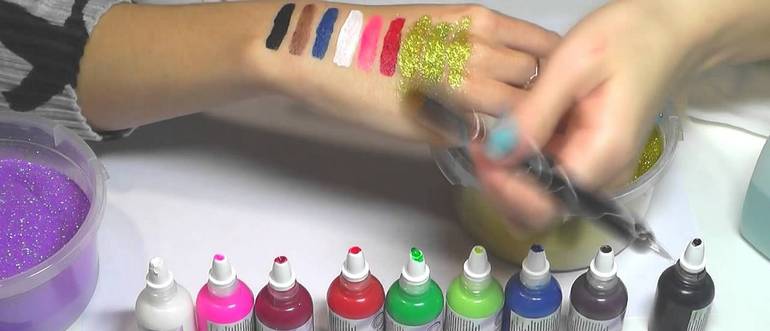
Image resolution: width=770 pixels, height=331 pixels. What are the coordinates of `red paint` in the screenshot? It's located at (350, 296), (389, 56).